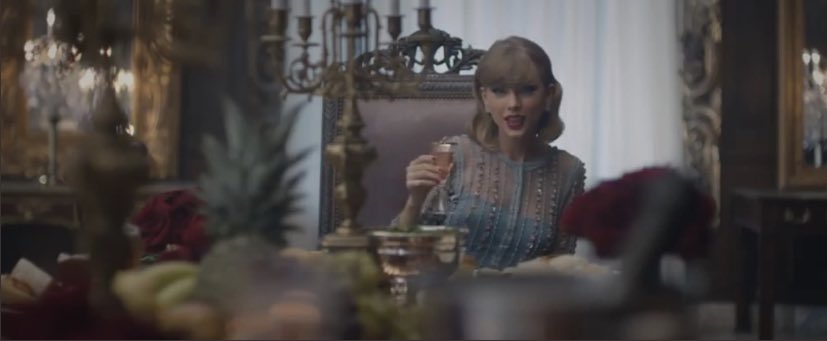
Find the location of `desk`. desk is located at coordinates (768, 216).